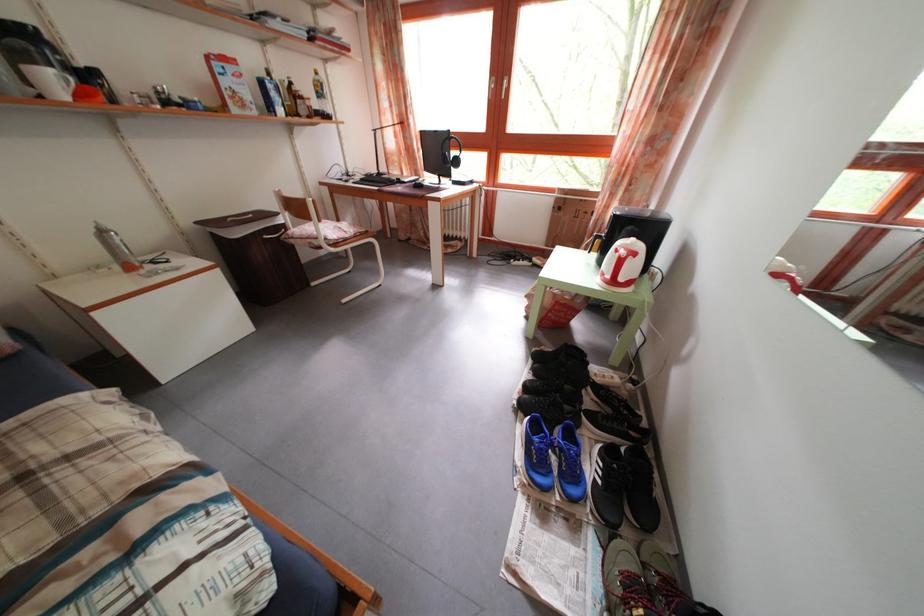
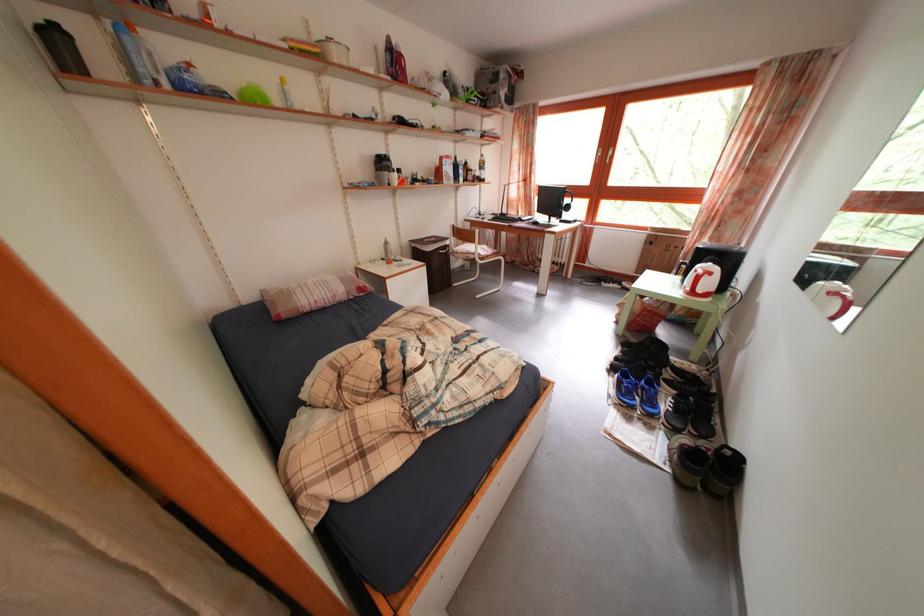
In a continuous first-person perspective shot, in which direction is the camera moving?

The cameraman moved toward left, backward.